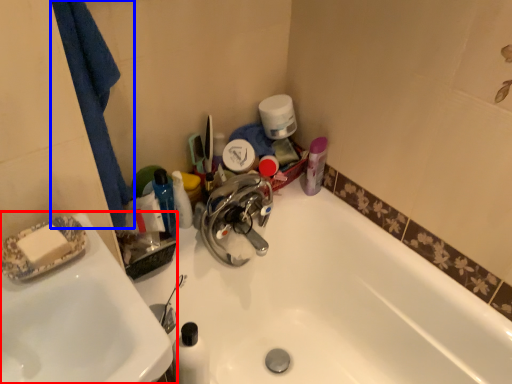
Question: Which point is further to the camera, sink (highlighted by a red box) or bath towel (highlighted by a blue box)?

Choices:
 (A) sink
 (B) bath towel

Answer: (B)